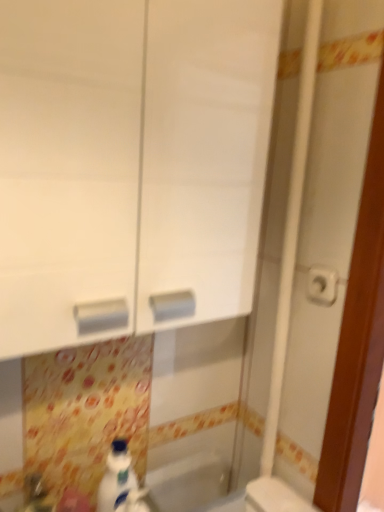
Question: Does point pos(327,283) appear closer or farther from the camera than point pos(296,505)?

Choices:
 (A) closer
 (B) farther

Answer: (A)

Question: From the image's perspective, is white plastic toilet paper at right positioned above or below white plastic toilet at lower right?

Choices:
 (A) below
 (B) above

Answer: (B)

Question: Considering the real-world distances, which object is closest to the white glossy bottle at lower center?

Choices:
 (A) white plastic toilet paper at right
 (B) white glossy bath at lower center
 (C) white glossy sink at lower left
 (D) white glossy cabinet at center
 (E) white plastic toilet at lower right

Answer: (C)

Question: Which object is the closest to the white glossy bottle at lower center?

Choices:
 (A) white plastic toilet paper at right
 (B) white glossy sink at lower left
 (C) white plastic toilet at lower right
 (D) white glossy bath at lower center
 (E) white glossy cabinet at center

Answer: (B)